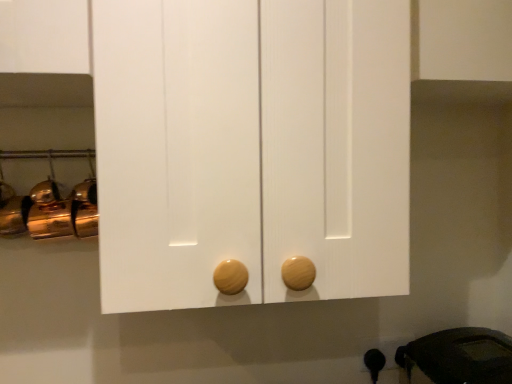
What do you see at coordinates (458, 357) in the screenshot? The height and width of the screenshot is (384, 512). I see `black rubber kettle at lower right` at bounding box center [458, 357].

Find the location of a particular element. The image size is (512, 384). black rubber kettle at lower right is located at coordinates (458, 357).

What do you see at coordinates (374, 363) in the screenshot? I see `wooden at bottom` at bounding box center [374, 363].

Where is `wooden at bottom`? The image size is (512, 384). wooden at bottom is located at coordinates (374, 363).

You are a GUI agent. You are given a task and a screenshot of the screen. Output one action in this format:
    pyautogui.click(x=<x>, y=<y>)
    Task: Click on the black rubber kettle at lower right
    
    Given the screenshot: What is the action you would take?
    pyautogui.click(x=458, y=357)

Between black rubber kettle at lower right and wooden at bottom, which one appears on the left side from the viewer's perspective?

From the viewer's perspective, wooden at bottom appears more on the left side.

Between black rubber kettle at lower right and wooden at bottom, which one is positioned behind?

wooden at bottom is more distant.

Does point (481, 346) come farther from viewer compared to point (365, 355)?

That is False.

From the image's perspective, which one is positioned higher, black rubber kettle at lower right or wooden at bottom?

black rubber kettle at lower right, from the image's perspective.

From a real-world perspective, is black rubber kettle at lower right under wooden at bottom?

No, from a real-world perspective, black rubber kettle at lower right is not under wooden at bottom.

Does black rubber kettle at lower right have a greater width compared to wooden at bottom?

Correct, the width of black rubber kettle at lower right exceeds that of wooden at bottom.

Consider the image. Does black rubber kettle at lower right have a lesser height compared to wooden at bottom?

In fact, black rubber kettle at lower right may be taller than wooden at bottom.

In terms of size, does black rubber kettle at lower right appear bigger or smaller than wooden at bottom?

black rubber kettle at lower right is bigger than wooden at bottom.

Is black rubber kettle at lower right situated inside wooden at bottom or outside?

black rubber kettle at lower right is located beyond the bounds of wooden at bottom.

Are black rubber kettle at lower right and wooden at bottom located far from each other?

No, black rubber kettle at lower right is not far away from wooden at bottom.

Is black rubber kettle at lower right looking in the opposite direction of wooden at bottom?

black rubber kettle at lower right is not turned away from wooden at bottom.

Where is `door handle below the black rubber kettle at lower right (from the image's perspective)`? Image resolution: width=512 pixels, height=384 pixels. door handle below the black rubber kettle at lower right (from the image's perspective) is located at coordinates (374, 363).

In the image, is wooden at bottom on the left side or the right side of black rubber kettle at lower right?

Clearly, wooden at bottom is on the left of black rubber kettle at lower right in the image.

Is wooden at bottom behind black rubber kettle at lower right?

Yes, wooden at bottom is behind black rubber kettle at lower right.

Which point is more forward, (377,357) or (431,358)?

The point (377,357) is closer to the camera.

From the image's perspective, which object appears higher, wooden at bottom or black rubber kettle at lower right?

black rubber kettle at lower right, from the image's perspective.

From a real-world perspective, is wooden at bottom located higher than black rubber kettle at lower right?

Actually, wooden at bottom is physically below black rubber kettle at lower right in the real world.

Consider the image. Is wooden at bottom thinner than black rubber kettle at lower right?

Yes.

Which of these two, wooden at bottom or black rubber kettle at lower right, stands shorter?

wooden at bottom is shorter.

Can you confirm if wooden at bottom is bigger than black rubber kettle at lower right?

Incorrect, wooden at bottom is not larger than black rubber kettle at lower right.

Do you think wooden at bottom is within black rubber kettle at lower right, or outside of it?

wooden at bottom is located beyond the bounds of black rubber kettle at lower right.

Are wooden at bottom and black rubber kettle at lower right beside each other?

wooden at bottom is not next to black rubber kettle at lower right, and they're not touching.

Is wooden at bottom facing towards black rubber kettle at lower right?

No.

Can you tell me how much wooden at bottom and black rubber kettle at lower right differ in facing direction?

The angle between the facing direction of wooden at bottom and the facing direction of black rubber kettle at lower right is 91 degrees.

Measure the distance between wooden at bottom and black rubber kettle at lower right.

wooden at bottom and black rubber kettle at lower right are 6.26 inches apart.

Find the location of a particular element. The height and width of the screenshot is (384, 512). door handle to the left of black rubber kettle at lower right is located at coordinates (374, 363).

Find the location of a particular element. door handle behind the black rubber kettle at lower right is located at coordinates (374, 363).

Find the location of a particular element. Image resolution: width=512 pixels, height=384 pixels. appliance on the right side of wooden at bottom is located at coordinates (458, 357).